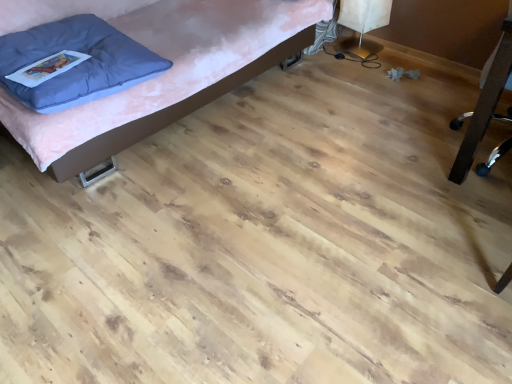
How much space does matte pink bed at upper left, which is the second furniture in right-to-left order, occupy horizontally?

It is 38.87 inches.

Locate an element on the screen. The height and width of the screenshot is (384, 512). blue soft pillow at upper left is located at coordinates (79, 63).

From the image's perspective, relative to matte pink bed at upper left, which ranks as the 1th furniture in left-to-right order, is blue soft pillow at upper left above or below?

From the image's perspective, blue soft pillow at upper left appears below matte pink bed at upper left, which ranks as the 1th furniture in left-to-right order.

Is blue soft pillow at upper left directly adjacent to matte pink bed at upper left, which ranks as the 1th furniture in left-to-right order?

No, blue soft pillow at upper left is not next to matte pink bed at upper left, which ranks as the 1th furniture in left-to-right order.

In the scene shown: From a real-world perspective, between blue soft pillow at upper left and matte pink bed at upper left, which ranks as the 1th furniture in left-to-right order, who is vertically lower?

matte pink bed at upper left, which ranks as the 1th furniture in left-to-right order.

In the scene shown: Is the position of blue soft pillow at upper left more distant than that of matte pink bed at upper left, which ranks as the 1th furniture in left-to-right order?

Yes, it is.

Is black plastic chair at right, the 2th furniture viewed from the left, taller than matte pink bed at upper left, which ranks as the 1th furniture in left-to-right order?

Yes, black plastic chair at right, the 2th furniture viewed from the left, is taller than matte pink bed at upper left, which ranks as the 1th furniture in left-to-right order.

Is black plastic chair at right, the 2th furniture viewed from the left, next to matte pink bed at upper left, which ranks as the 1th furniture in left-to-right order?

No.

Between black plastic chair at right, which ranks as the first furniture in right-to-left order, and matte pink bed at upper left, which is the second furniture in right-to-left order, which one is positioned behind?

matte pink bed at upper left, which is the second furniture in right-to-left order, is behind.

Based on their positions, is black plastic chair at right, which ranks as the first furniture in right-to-left order, located to the left or right of matte pink bed at upper left, which ranks as the 1th furniture in left-to-right order?

black plastic chair at right, which ranks as the first furniture in right-to-left order, is to the right of matte pink bed at upper left, which ranks as the 1th furniture in left-to-right order.

Considering the sizes of objects black plastic chair at right, the 2th furniture viewed from the left, and blue soft pillow at upper left in the image provided, who is taller, black plastic chair at right, the 2th furniture viewed from the left, or blue soft pillow at upper left?

black plastic chair at right, the 2th furniture viewed from the left, is taller.

In order to click on furniture below the blue soft pillow at upper left (from the image's perspective) in this screenshot , I will do `click(486, 106)`.

Which of these two, black plastic chair at right, which ranks as the first furniture in right-to-left order, or blue soft pillow at upper left, is wider?

Wider between the two is black plastic chair at right, which ranks as the first furniture in right-to-left order.

Is black plastic chair at right, which ranks as the first furniture in right-to-left order, oriented away from blue soft pillow at upper left?

No, black plastic chair at right, which ranks as the first furniture in right-to-left order,'s orientation is not away from blue soft pillow at upper left.

Consider the image. From the image's perspective, is matte pink bed at upper left, which ranks as the 1th furniture in left-to-right order, under black plastic chair at right, the 2th furniture viewed from the left?

Incorrect, from the image's perspective, matte pink bed at upper left, which ranks as the 1th furniture in left-to-right order, is higher than black plastic chair at right, the 2th furniture viewed from the left.

Find the location of a particular element. furniture that appears on the left of black plastic chair at right, the 2th furniture viewed from the left is located at coordinates (168, 75).

Is matte pink bed at upper left, which ranks as the 1th furniture in left-to-right order, oriented away from black plastic chair at right, the 2th furniture viewed from the left?

No, matte pink bed at upper left, which ranks as the 1th furniture in left-to-right order,'s orientation is not away from black plastic chair at right, the 2th furniture viewed from the left.

Is the position of matte pink bed at upper left, which is the second furniture in right-to-left order, more distant than that of blue soft pillow at upper left?

No, matte pink bed at upper left, which is the second furniture in right-to-left order, is closer to the camera.

Is matte pink bed at upper left, which is the second furniture in right-to-left order, looking in the opposite direction of blue soft pillow at upper left?

Yes.

Is matte pink bed at upper left, which ranks as the 1th furniture in left-to-right order, completely or partially outside of blue soft pillow at upper left?

Yes.

Is point (159, 8) closer to viewer compared to point (15, 33)?

No, it is behind (15, 33).

Considering the relative sizes of blue soft pillow at upper left and black plastic chair at right, the 2th furniture viewed from the left, in the image provided, is blue soft pillow at upper left shorter than black plastic chair at right, the 2th furniture viewed from the left,?

Yes.

Is there a large distance between blue soft pillow at upper left and black plastic chair at right, the 2th furniture viewed from the left?

Yes, blue soft pillow at upper left and black plastic chair at right, the 2th furniture viewed from the left, are located far from each other.

Would you say blue soft pillow at upper left contains black plastic chair at right, which ranks as the first furniture in right-to-left order?

No.

In terms of size, does blue soft pillow at upper left appear bigger or smaller than black plastic chair at right, the 2th furniture viewed from the left?

Considering their sizes, blue soft pillow at upper left takes up less space than black plastic chair at right, the 2th furniture viewed from the left.

I want to click on furniture above the blue soft pillow at upper left (from the image's perspective), so click(x=168, y=75).

Identify the location of furniture below the matte pink bed at upper left, which is the second furniture in right-to-left order (from the image's perspective). The width and height of the screenshot is (512, 384). (486, 106).

From the image, which object appears to be nearer to matte pink bed at upper left, which ranks as the 1th furniture in left-to-right order, black plastic chair at right, which ranks as the first furniture in right-to-left order, or blue soft pillow at upper left?

blue soft pillow at upper left is positioned closer to the anchor matte pink bed at upper left, which ranks as the 1th furniture in left-to-right order.

Considering their positions, is black plastic chair at right, the 2th furniture viewed from the left, positioned further to blue soft pillow at upper left than matte pink bed at upper left, which ranks as the 1th furniture in left-to-right order?

black plastic chair at right, the 2th furniture viewed from the left, is positioned further to the anchor blue soft pillow at upper left.

Which object lies nearer to the anchor point matte pink bed at upper left, which is the second furniture in right-to-left order, blue soft pillow at upper left or black plastic chair at right, the 2th furniture viewed from the left?

blue soft pillow at upper left lies closer to matte pink bed at upper left, which is the second furniture in right-to-left order, than the other object.

Based on their spatial positions, is matte pink bed at upper left, which is the second furniture in right-to-left order, or blue soft pillow at upper left further from black plastic chair at right, the 2th furniture viewed from the left?

blue soft pillow at upper left is positioned further to the anchor black plastic chair at right, the 2th furniture viewed from the left.

Which object lies further to the anchor point black plastic chair at right, which ranks as the first furniture in right-to-left order, blue soft pillow at upper left or matte pink bed at upper left, which is the second furniture in right-to-left order?

blue soft pillow at upper left is positioned further to the anchor black plastic chair at right, which ranks as the first furniture in right-to-left order.

When comparing their distances from blue soft pillow at upper left, does matte pink bed at upper left, which ranks as the 1th furniture in left-to-right order, or black plastic chair at right, which ranks as the first furniture in right-to-left order, seem closer?

The object closer to blue soft pillow at upper left is matte pink bed at upper left, which ranks as the 1th furniture in left-to-right order.

Identify the location of furniture between blue soft pillow at upper left and black plastic chair at right, the 2th furniture viewed from the left. The image size is (512, 384). (168, 75).